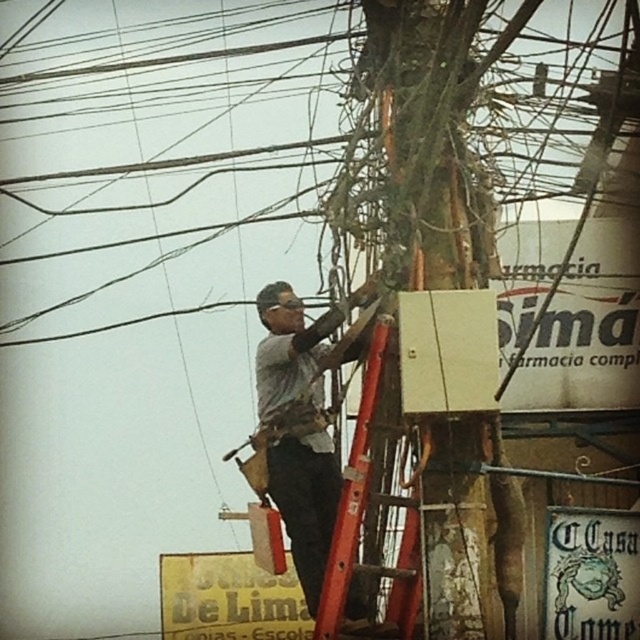
Consider the image. Is gray fabric construction worker at center shorter than red metal ladder at center?

No.

Who is more forward, (269, 403) or (314, 637)?

Point (314, 637) is in front.

Where is `gray fabric construction worker at center`? This screenshot has height=640, width=640. gray fabric construction worker at center is located at coordinates (307, 502).

Can you confirm if green mossy tree trunk at center is shorter than gray fabric construction worker at center?

Incorrect, green mossy tree trunk at center's height does not fall short of gray fabric construction worker at center's.

Is green mossy tree trunk at center closer to camera compared to gray fabric construction worker at center?

Yes, green mossy tree trunk at center is closer to the viewer.

This screenshot has height=640, width=640. Describe the element at coordinates (433, 339) in the screenshot. I see `green mossy tree trunk at center` at that location.

Locate an element on the screen. green mossy tree trunk at center is located at coordinates (433, 339).

Does point (385, 282) come in front of point (346, 522)?

Yes, it is.

Which is behind, point (481, 342) or point (364, 428)?

Point (364, 428)

Describe the element at coordinates (433, 339) in the screenshot. I see `green mossy tree trunk at center` at that location.

Locate an element on the screen. Image resolution: width=640 pixels, height=640 pixels. green mossy tree trunk at center is located at coordinates (433, 339).